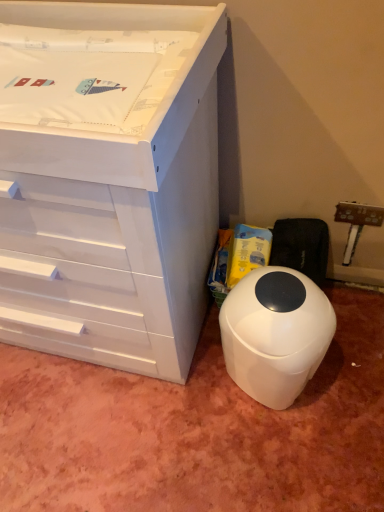
You are a GUI agent. You are given a task and a screenshot of the screen. Output one action in this format:
    pyautogui.click(x=<x>, y=<y>)
    Task: Click on the free spot to the right of white plastic waste bin at lower right
    
    Given the screenshot: What is the action you would take?
    pyautogui.click(x=347, y=378)